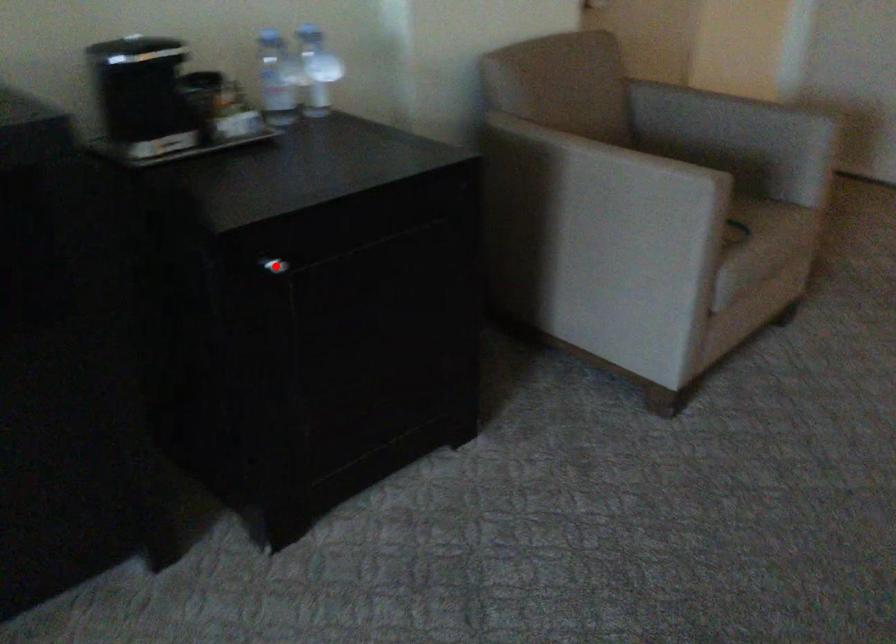
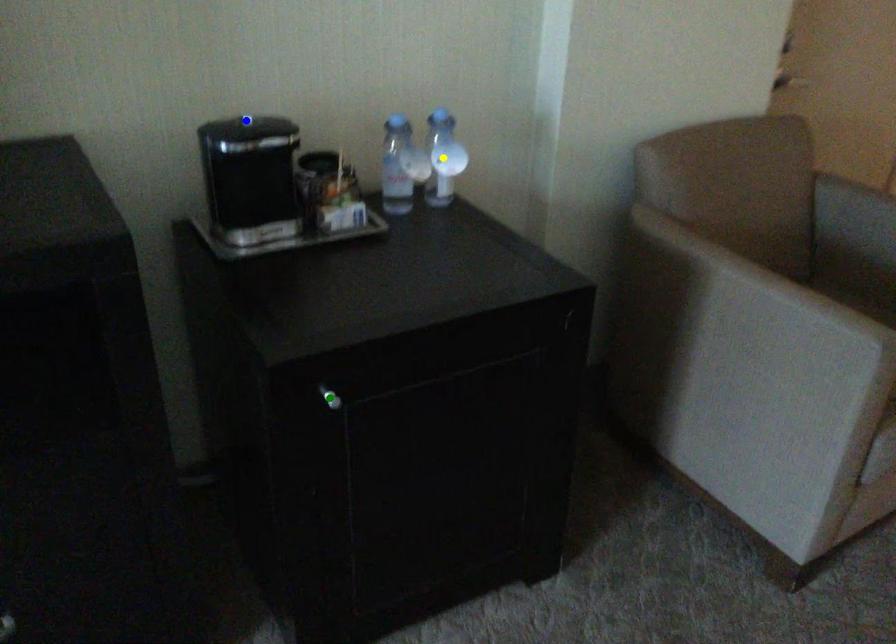
Question: I am providing you with two images of the same scene from different viewpoints. A red point is marked on the first image. You are given multiple points on the second image. Can you choose the point in image 2 that corresponds to the point in image 1?

Choices:
 (A) green point
 (B) yellow point
 (C) blue point

Answer: (A)